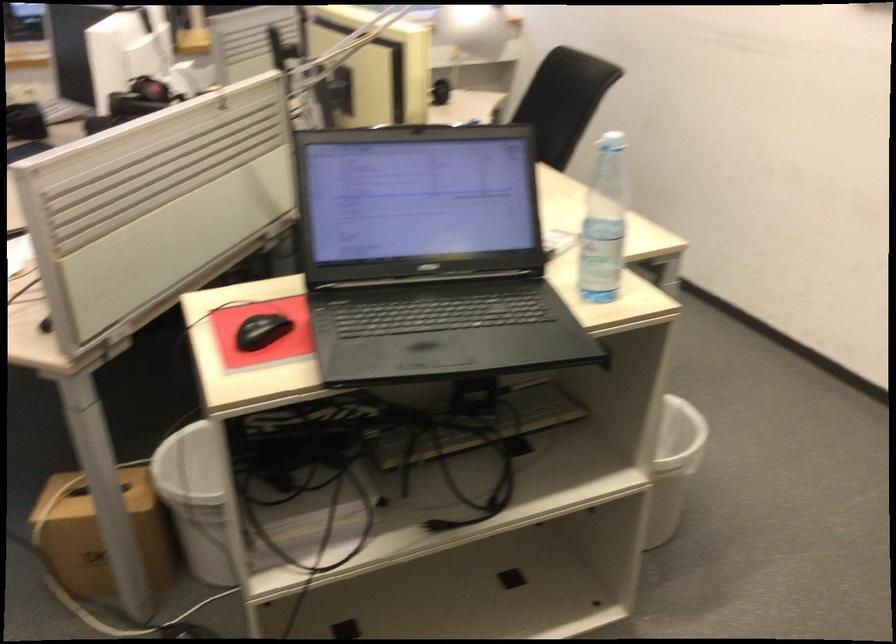
The location [261,330] corresponds to which object?

It corresponds to the black computer mouse in the image.